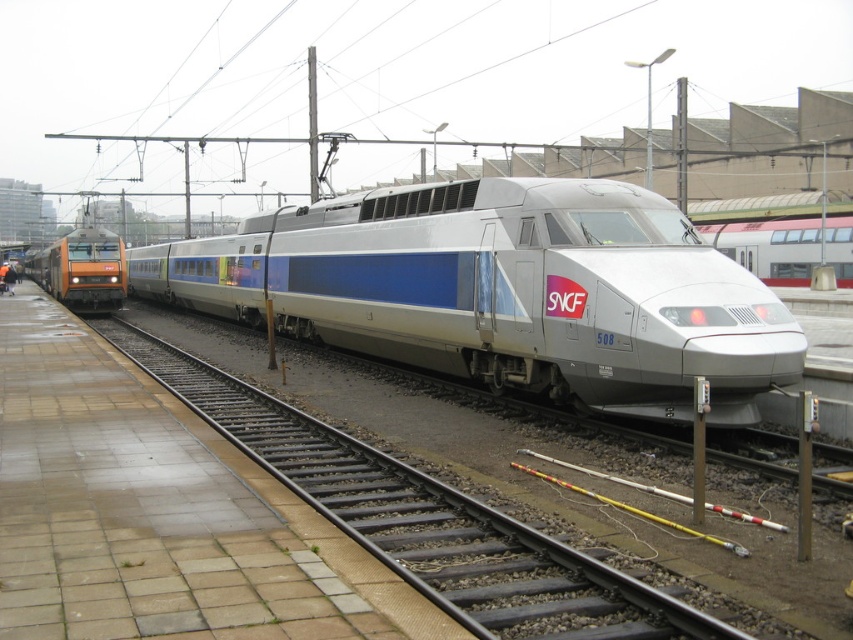
Is silver metallic bullet train at center smaller than orange metallic locomotive at left?

Indeed, silver metallic bullet train at center has a smaller size compared to orange metallic locomotive at left.

Does silver metallic bullet train at center have a greater width compared to orange metallic locomotive at left?

No.

Which is behind, point (567, 230) or point (55, 250)?

Positioned behind is point (55, 250).

Where is `silver metallic bullet train at center`? The height and width of the screenshot is (640, 853). silver metallic bullet train at center is located at coordinates (503, 291).

Does silver metallic bullet train at center have a smaller size compared to silver metallic train at center?

Actually, silver metallic bullet train at center might be larger than silver metallic train at center.

Who is higher up, silver metallic bullet train at center or silver metallic train at center?

silver metallic train at center is higher up.

Does point (688, 310) lie in front of point (831, 243)?

Yes, it is in front of point (831, 243).

You are a GUI agent. You are given a task and a screenshot of the screen. Output one action in this format:
    pyautogui.click(x=<x>, y=<y>)
    Task: Click on the silver metallic bullet train at center
    Image resolution: width=853 pixels, height=640 pixels.
    Given the screenshot: What is the action you would take?
    pyautogui.click(x=503, y=291)

Is silver metallic train at center below orange metallic locomotive at left?

Correct, silver metallic train at center is located below orange metallic locomotive at left.

Does silver metallic train at center appear on the right side of orange metallic locomotive at left?

Correct, you'll find silver metallic train at center to the right of orange metallic locomotive at left.

Is point (846, 280) more distant than point (42, 264)?

No.

Identify the location of silver metallic train at center. This screenshot has height=640, width=853. (785, 246).